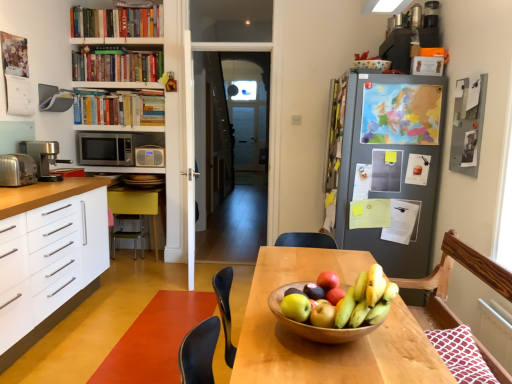
This screenshot has width=512, height=384. I want to click on vacant space underneath hardcover books at upper left, which is the 2th book in bottom-to-top order (from a real-world perspective), so click(x=120, y=76).